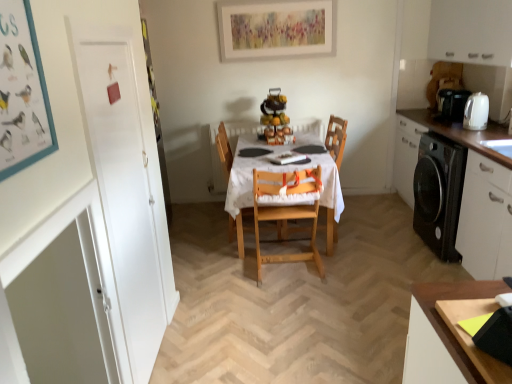
Find the location of `vacant area in front of wooden chair at center`. vacant area in front of wooden chair at center is located at coordinates (346, 254).